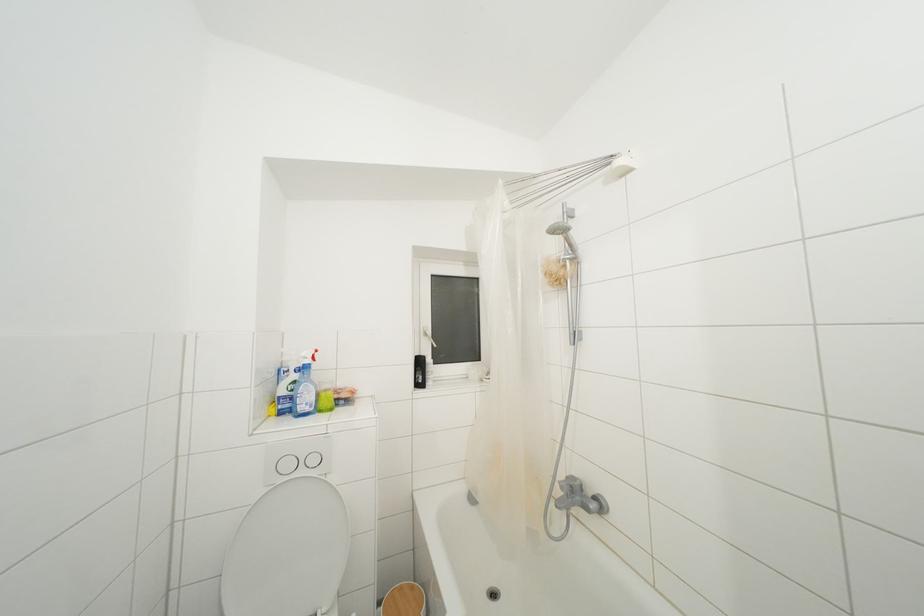
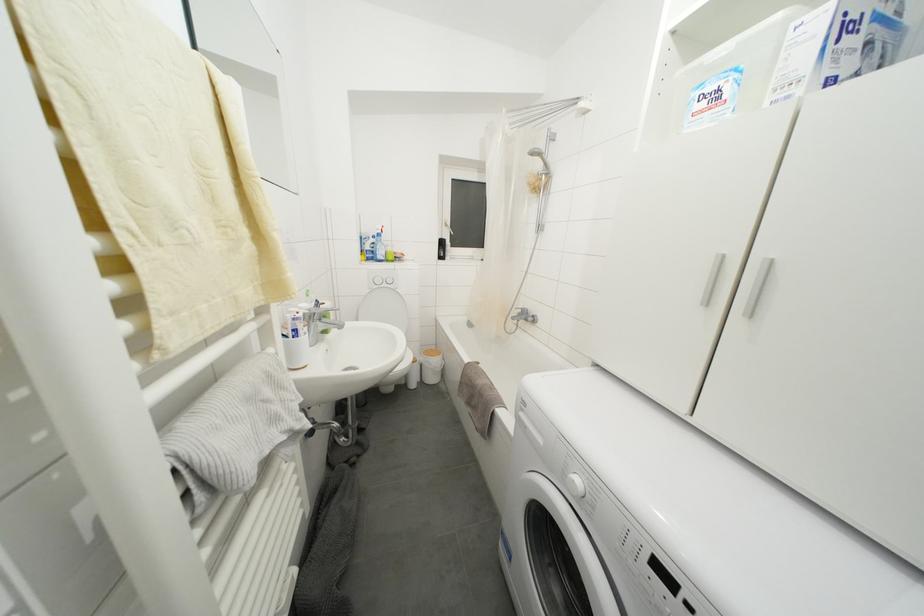
Question: The images are taken continuously from a first-person perspective. In which direction are you moving?

Choices:
 (A) Left
 (B) Right
 (C) Forward
 (D) Backward

Answer: (D)